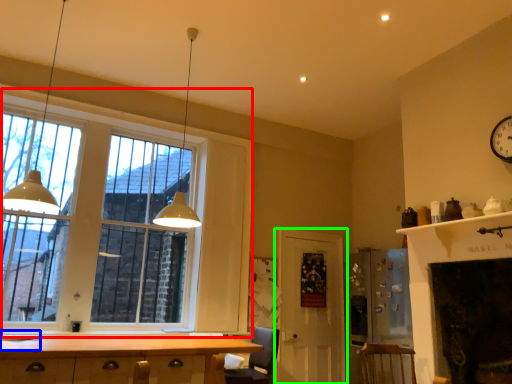
Question: Estimate the real-world distances between objects in this image. Which object is closer to window (highlighted by a red box), sink (highlighted by a blue box) or door (highlighted by a green box)?

Choices:
 (A) sink
 (B) door

Answer: (B)